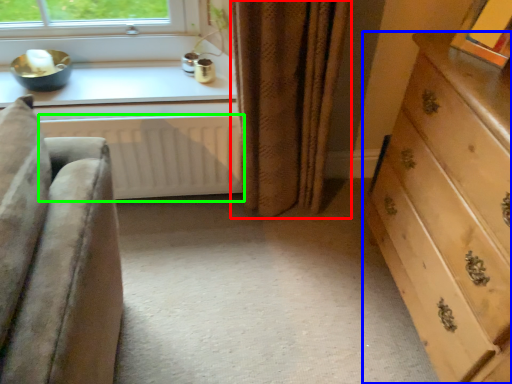
Question: Based on their relative distances, which object is nearer to curtain (highlighted by a red box)? Choose from chest of drawers (highlighted by a blue box) and radiator (highlighted by a green box).

Choices:
 (A) chest of drawers
 (B) radiator

Answer: (B)